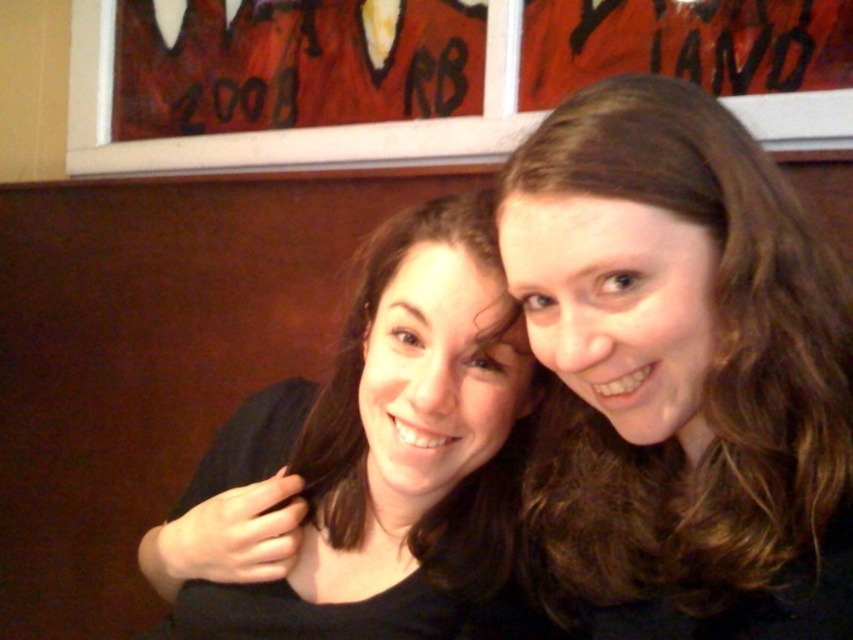
Who is positioned more to the right, brown hair at upper right or black matte hair at center?

Positioned to the right is brown hair at upper right.

Is brown hair at upper right taller than black matte hair at center?

Yes, brown hair at upper right is taller than black matte hair at center.

Does point (708, 465) come behind point (431, 250)?

No.

What are the coordinates of `brown hair at upper right` in the screenshot? It's located at (680, 372).